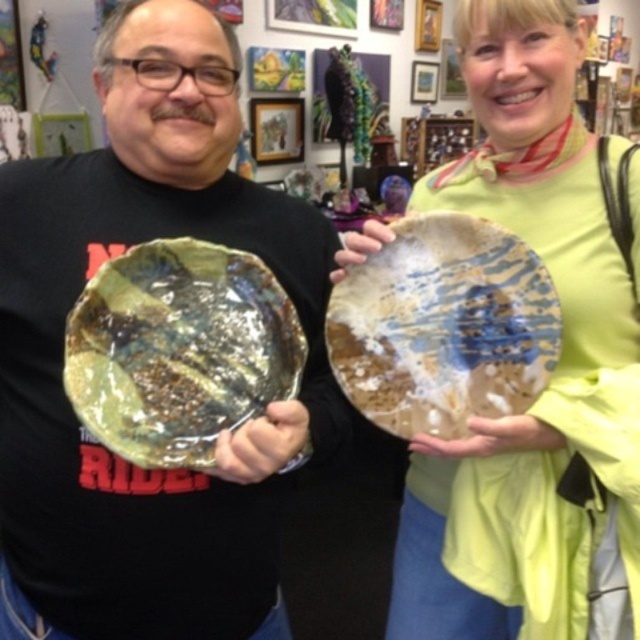
You are an art curator arranging an exhibition. You have two plates to display on a shelf. The metallic gold plate at center and the matte ceramic plate at center. According to their positions in the image, which plate should you place higher on the shelf to maintain the same spatial arrangement?

The metallic gold plate at center should be placed higher on the shelf since it is positioned above the matte ceramic plate at center in the image.

You are an art curator examining two plates displayed in a gallery. The metallic gold plate at center and the translucent amber plate at center are positioned in a specific way. Based on their arrangement, which plate is placed higher up?

The translucent amber plate at center is placed higher up since the metallic gold plate at center is positioned below it.